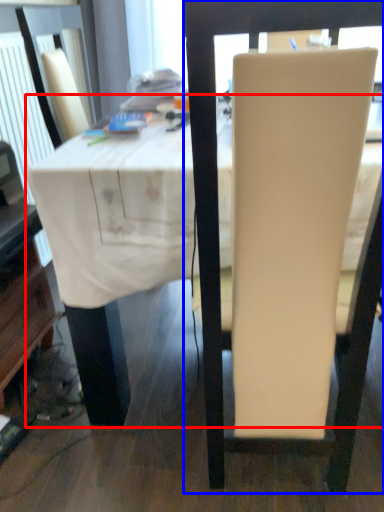
Question: Which of the following is the farthest to the observer, table (highlighted by a red box) or chair (highlighted by a blue box)?

Choices:
 (A) table
 (B) chair

Answer: (A)